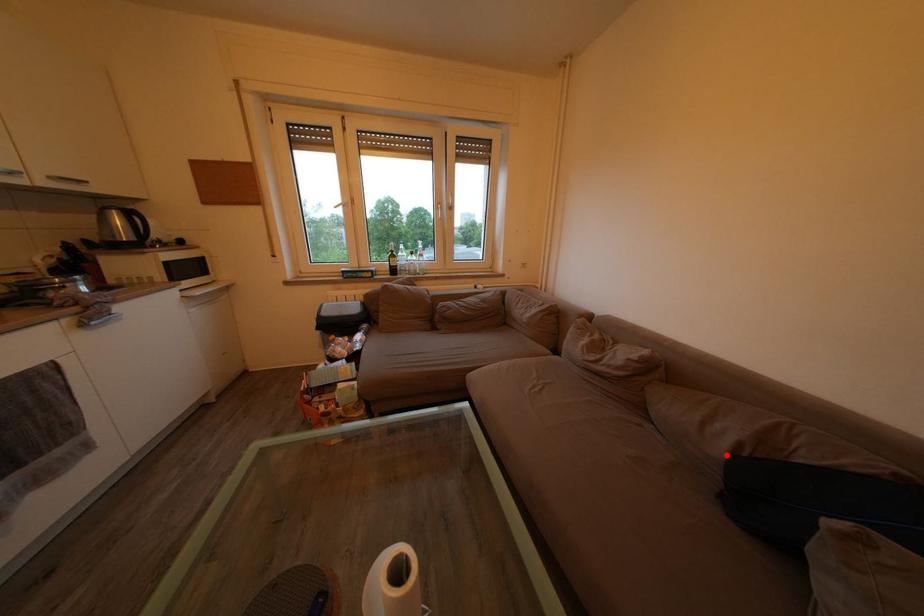
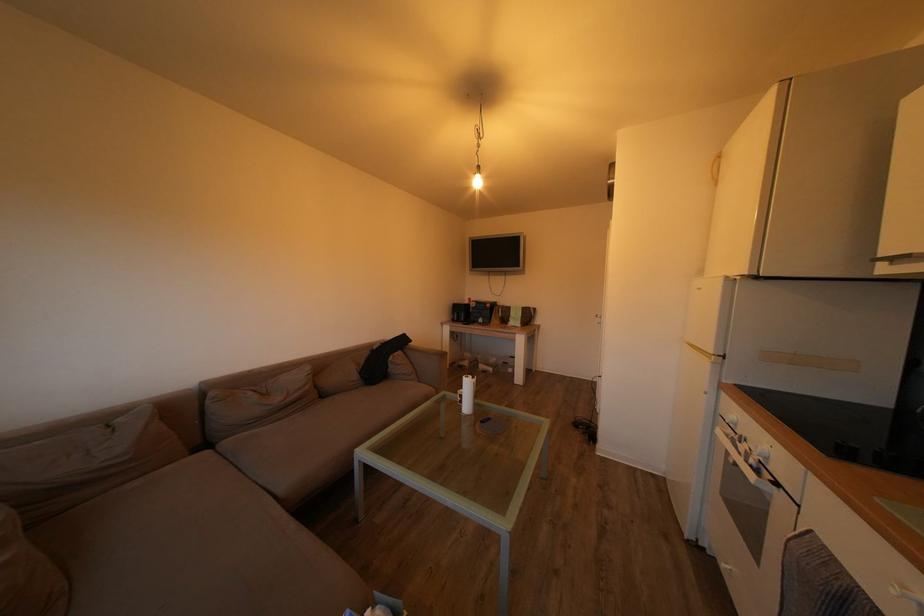
Question: I am providing you with two images of the same scene from different viewpoints. A red point is marked on the first image. Is the red point's position out of view in image 2?

Choices:
 (A) Yes
 (B) No

Answer: (B)